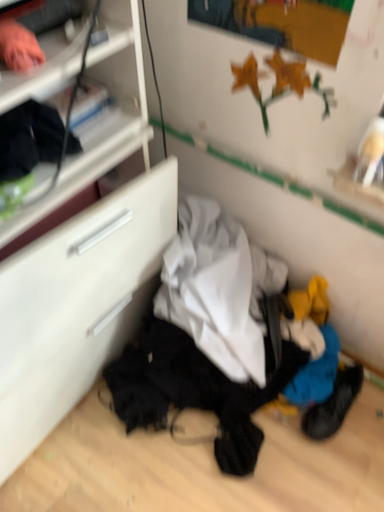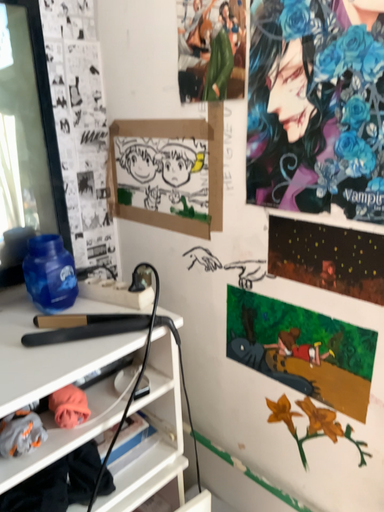
Question: Which way did the camera rotate in the video?

Choices:
 (A) rotated left
 (B) rotated right

Answer: (A)